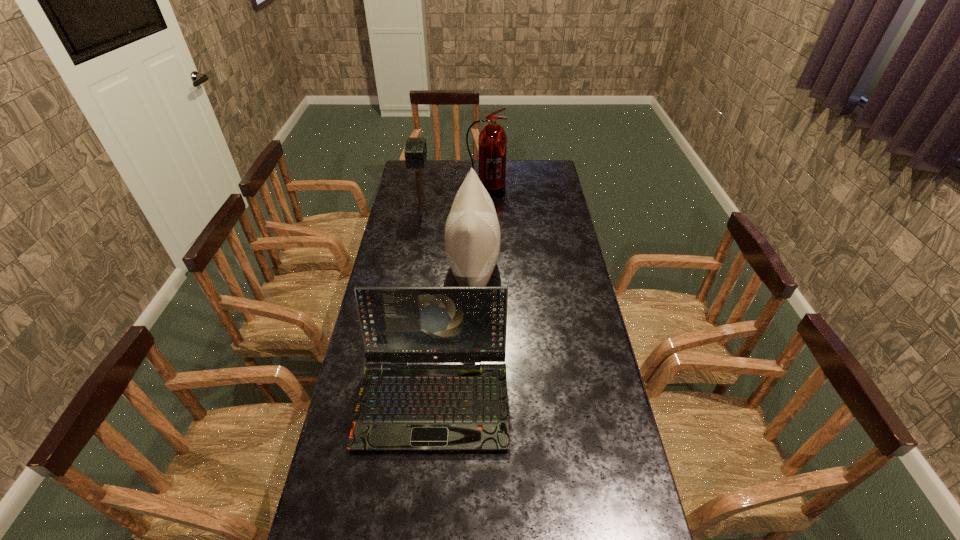
In order to click on mallet at the left edge in this screenshot , I will do `click(415, 152)`.

At what (x,y) coordinates should I click in order to perform the action: click on laptop computer at the left edge. Please return your answer as a coordinate pair (x, y). Looking at the image, I should click on (401, 406).

Locate an element on the screen. The image size is (960, 540). free location at the far edge is located at coordinates (475, 168).

Where is `free space at the left edge`? Image resolution: width=960 pixels, height=540 pixels. free space at the left edge is located at coordinates (398, 272).

Identify the location of free spot at the right edge of the desktop. (560, 231).

Identify the location of free region at the far left corner. The width and height of the screenshot is (960, 540). (423, 179).

Image resolution: width=960 pixels, height=540 pixels. I want to click on free space at the far right corner of the desktop, so 542,178.

This screenshot has height=540, width=960. I want to click on object that stands as the closest to the farthest object, so tap(415, 152).

Locate an element on the screen. object that ranks as the closest to the fire extinguisher is located at coordinates tap(415, 152).

Find the location of `blank area in the image that satisfies the following two spatial constraints: 1. on the front-facing side of the tallest object; 2. on the front side of the third farthest object`. blank area in the image that satisfies the following two spatial constraints: 1. on the front-facing side of the tallest object; 2. on the front side of the third farthest object is located at coordinates (488, 271).